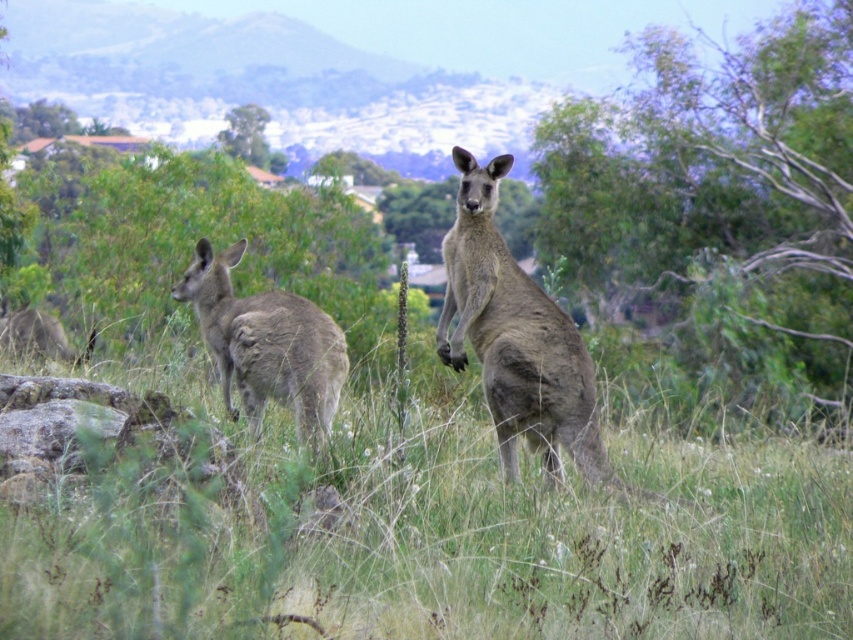
Question: Considering the real-world distances, which object is farthest from the gray fur kangaroo at center?

Choices:
 (A) green leafy tree at upper center
 (B) green grass at center

Answer: (A)

Question: Which point appears farthest from the camera in this image?

Choices:
 (A) (282, 164)
 (B) (718, 145)

Answer: (A)

Question: Can you confirm if green leafy tree at center is thinner than grayish-brown fur kangaroo at center?

Choices:
 (A) no
 (B) yes

Answer: (A)

Question: Is green leafy tree at center bigger than green leafy tree at upper center?

Choices:
 (A) no
 (B) yes

Answer: (B)

Question: Observing the image, what is the correct spatial positioning of green grass at center in reference to gray fur kangaroo at center?

Choices:
 (A) below
 (B) above

Answer: (A)

Question: Which of the following is the farthest from the observer?

Choices:
 (A) (315, 385)
 (B) (228, 132)
 (C) (251, 595)
 (D) (531, 412)

Answer: (B)